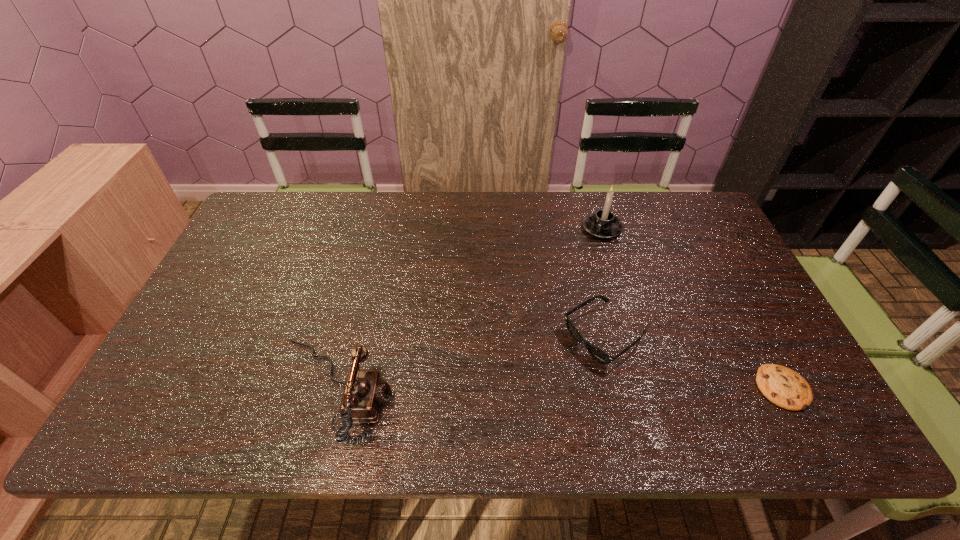
You are a GUI agent. You are given a task and a screenshot of the screen. Output one action in this format:
    pyautogui.click(x=<x>, y=<y>)
    Task: Click on the vacant space on the desktop that is between the leftmost object and the cookie and is positioned on the front-facing side of the third tallest object
    
    Given the screenshot: What is the action you would take?
    pyautogui.click(x=527, y=389)

Locate an element on the screen. The width and height of the screenshot is (960, 540). free space on the desktop that is between the third shortest object and the shortest object and is positioned with a handle on the side of the tallest object is located at coordinates click(515, 389).